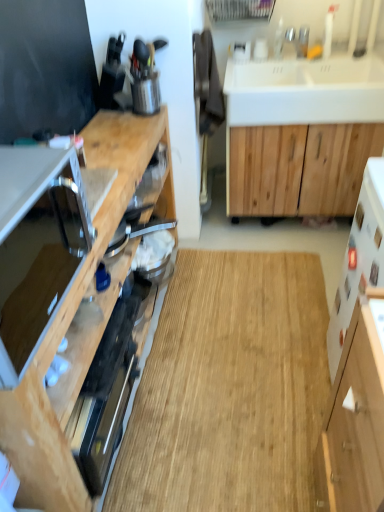
Question: Is silver metallic faucet at upper right completely or partially outside of natural wood cabinet at center, acting as the 1th cabinetry starting from the right?

Choices:
 (A) yes
 (B) no

Answer: (A)

Question: Can you confirm if silver metallic faucet at upper right is shorter than natural wood cabinet at center, the 3th cabinetry from the left?

Choices:
 (A) yes
 (B) no

Answer: (A)

Question: From a real-world perspective, is silver metallic faucet at upper right on top of natural wood cabinet at center, the 3th cabinetry from the left?

Choices:
 (A) no
 (B) yes

Answer: (B)

Question: Is silver metallic faucet at upper right at the right side of natural wood cabinet at center, acting as the 1th cabinetry starting from the right?

Choices:
 (A) no
 (B) yes

Answer: (A)

Question: Are silver metallic faucet at upper right and natural wood cabinet at center, acting as the 1th cabinetry starting from the right, located far from each other?

Choices:
 (A) yes
 (B) no

Answer: (B)

Question: Is natural wood cabinet at center, the 3th cabinetry from the left, a part of silver metallic faucet at upper right?

Choices:
 (A) yes
 (B) no

Answer: (B)

Question: Can you confirm if wooden cabinet at left, the 1th cabinetry viewed from the left, is thinner than metallic silver utensil holder at upper left, the 1th appliance in the back-to-front sequence?

Choices:
 (A) yes
 (B) no

Answer: (B)

Question: Would you consider wooden cabinet at left, the 1th cabinetry viewed from the left, to be distant from metallic silver utensil holder at upper left, which is counted as the second appliance, starting from the bottom?

Choices:
 (A) yes
 (B) no

Answer: (B)

Question: From the image's perspective, does wooden cabinet at left, the 1th cabinetry viewed from the left, appear higher than metallic silver utensil holder at upper left, which appears as the 1th appliance when viewed from the top?

Choices:
 (A) yes
 (B) no

Answer: (B)

Question: Does wooden cabinet at left, the 1th cabinetry viewed from the left, appear on the left side of metallic silver utensil holder at upper left, positioned as the second appliance in front-to-back order?

Choices:
 (A) no
 (B) yes

Answer: (B)

Question: Would you say wooden cabinet at left, acting as the 3th cabinetry starting from the right, contains metallic silver utensil holder at upper left, which appears as the 1th appliance when viewed from the top?

Choices:
 (A) no
 (B) yes

Answer: (A)

Question: Is wooden cabinet at left, the 1th cabinetry viewed from the left, placed right next to metallic silver utensil holder at upper left, which appears as the 1th appliance when viewed from the top?

Choices:
 (A) no
 (B) yes

Answer: (A)

Question: Considering the relative sizes of white matte cabinet at lower right, the 2th cabinetry from the left, and natural wood cabinet at center, the 3th cabinetry from the left, in the image provided, is white matte cabinet at lower right, the 2th cabinetry from the left, shorter than natural wood cabinet at center, the 3th cabinetry from the left,?

Choices:
 (A) yes
 (B) no

Answer: (B)